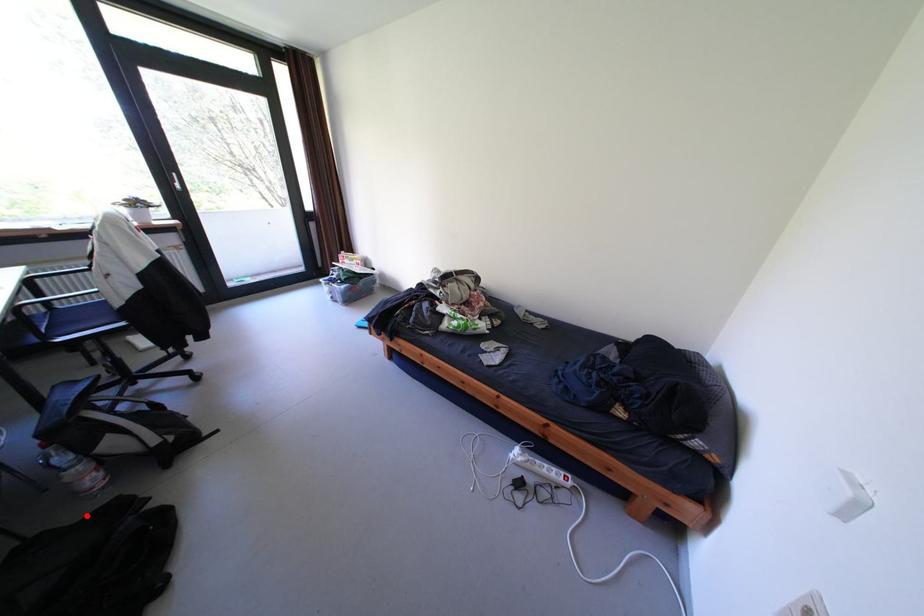
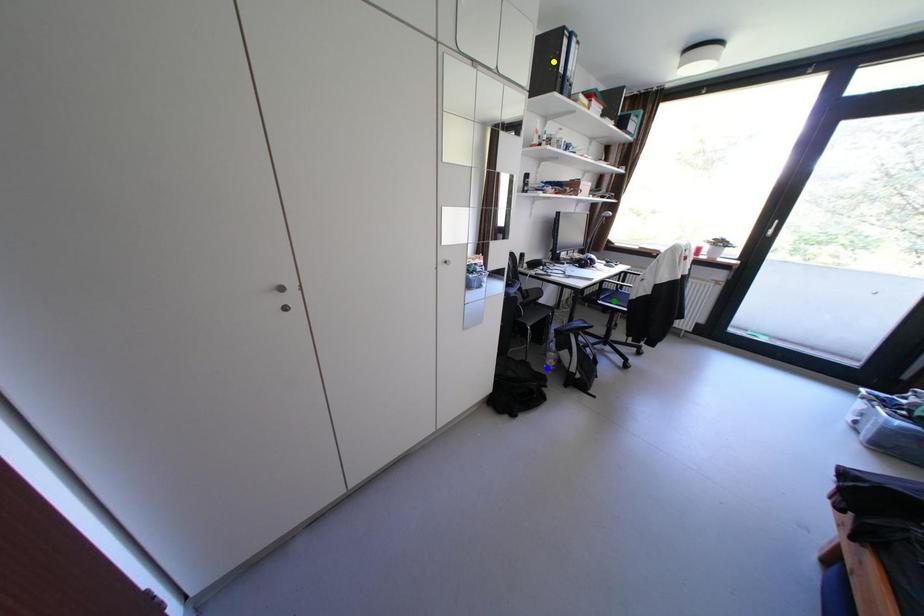
Question: I am providing you with two images of the same scene from different viewpoints. A red point is marked on the first image. You are given multiple points on the second image. Which point in image 2 is actually the same real-world point as the red point in image 1?

Choices:
 (A) blue point
 (B) green point
 (C) yellow point

Answer: (A)